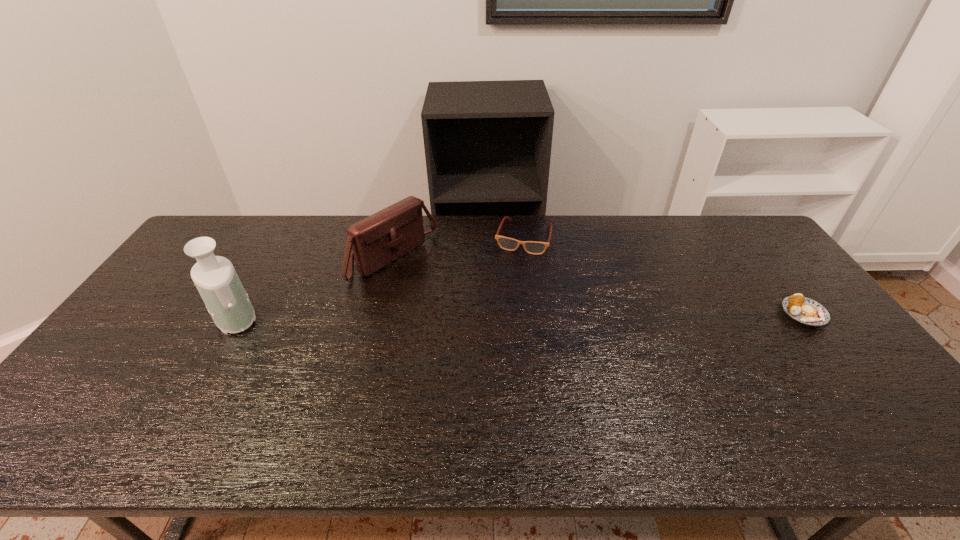
Locate an element on the screen. The width and height of the screenshot is (960, 540). vacant spot on the desktop that is between the tallest object and the shortest object and is positioned on the front flap of the second object from left to right is located at coordinates (485, 315).

Where is `vacant space on the desktop that is between the juicer and the shortest object and is positioned on the front-facing side of the second object from right to left`? This screenshot has height=540, width=960. vacant space on the desktop that is between the juicer and the shortest object and is positioned on the front-facing side of the second object from right to left is located at coordinates (498, 315).